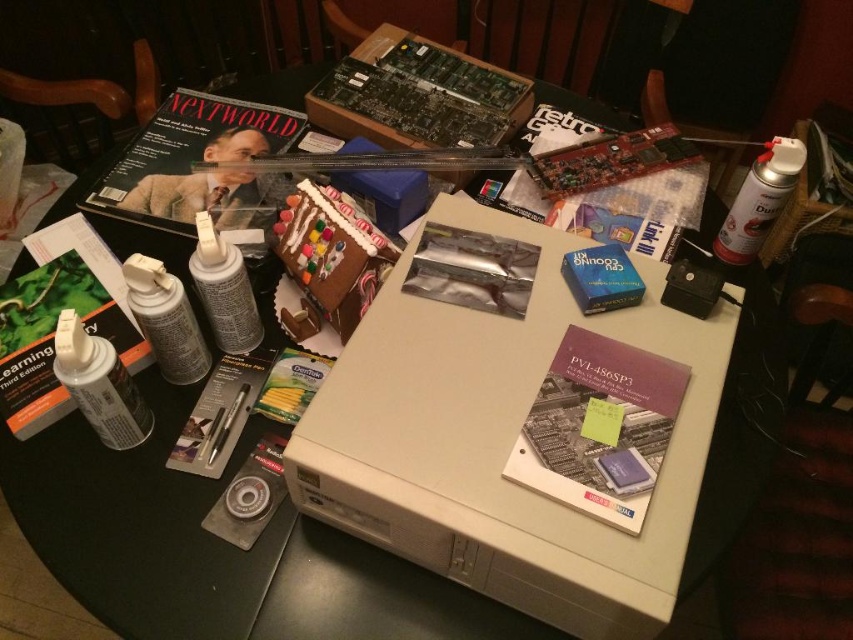
Measure the distance from matte black magazine at upper left to matte white spray can at left.

The distance of matte black magazine at upper left from matte white spray can at left is 12.89 inches.

Does matte black magazine at upper left come in front of matte white spray can at left?

That is False.

Which is behind, point (218, 100) or point (160, 316)?

Point (218, 100)

Where is `matte black magazine at upper left`? matte black magazine at upper left is located at coordinates (195, 163).

The width and height of the screenshot is (853, 640). What are the coordinates of `matte white spray can at left` in the screenshot? It's located at (165, 320).

Describe the element at coordinates (165, 320) in the screenshot. I see `matte white spray can at left` at that location.

Is point (160, 275) in front of point (236, 412)?

Yes, it is in front of point (236, 412).

The width and height of the screenshot is (853, 640). In order to click on matte white spray can at left in this screenshot , I will do `click(165, 320)`.

Is purple paper at center shorter than matte black magazine at upper center?

Correct, purple paper at center is not as tall as matte black magazine at upper center.

You are a GUI agent. You are given a task and a screenshot of the screen. Output one action in this format:
    pyautogui.click(x=<x>, y=<y>)
    Task: Click on the purple paper at center
    Image resolution: width=853 pixels, height=640 pixels.
    Given the screenshot: What is the action you would take?
    pyautogui.click(x=599, y=428)